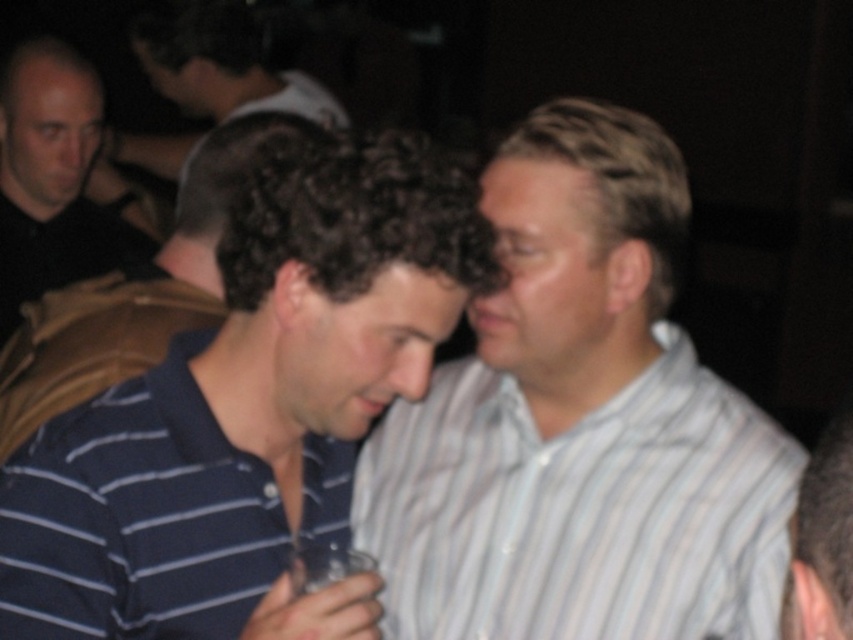
Is blue striped shirt at center wider than black shirt at left?

Yes.

Who is taller, blue striped shirt at center or black shirt at left?

With more height is black shirt at left.

From the picture: Measure the distance between blue striped shirt at center and camera.

Answer: blue striped shirt at center and camera are 33.53 inches apart.

The width and height of the screenshot is (853, 640). I want to click on blue striped shirt at center, so click(x=248, y=410).

Between white striped shirt at center and blue striped shirt at center, which one appears on the left side from the viewer's perspective?

Positioned to the left is blue striped shirt at center.

Does white striped shirt at center have a greater width compared to blue striped shirt at center?

Yes.

This screenshot has height=640, width=853. I want to click on white striped shirt at center, so point(579,424).

Does blue striped polo shirt at center appear over dark brown hair at upper center?

No, blue striped polo shirt at center is not above dark brown hair at upper center.

Between blue striped polo shirt at center and dark brown hair at upper center, which one appears on the right side from the viewer's perspective?

Positioned to the right is blue striped polo shirt at center.

Find the location of a particular element. The image size is (853, 640). blue striped polo shirt at center is located at coordinates (136, 289).